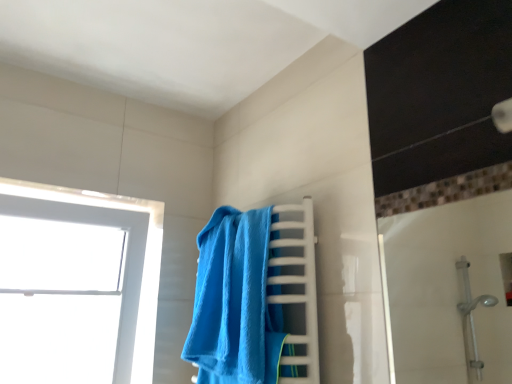
What do you see at coordinates (236, 302) in the screenshot?
I see `blue plush towel at center` at bounding box center [236, 302].

Locate an element on the screen. This screenshot has width=512, height=384. blue plush towel at center is located at coordinates (236, 302).

Where is `blue plush towel at center`? The height and width of the screenshot is (384, 512). blue plush towel at center is located at coordinates (236, 302).